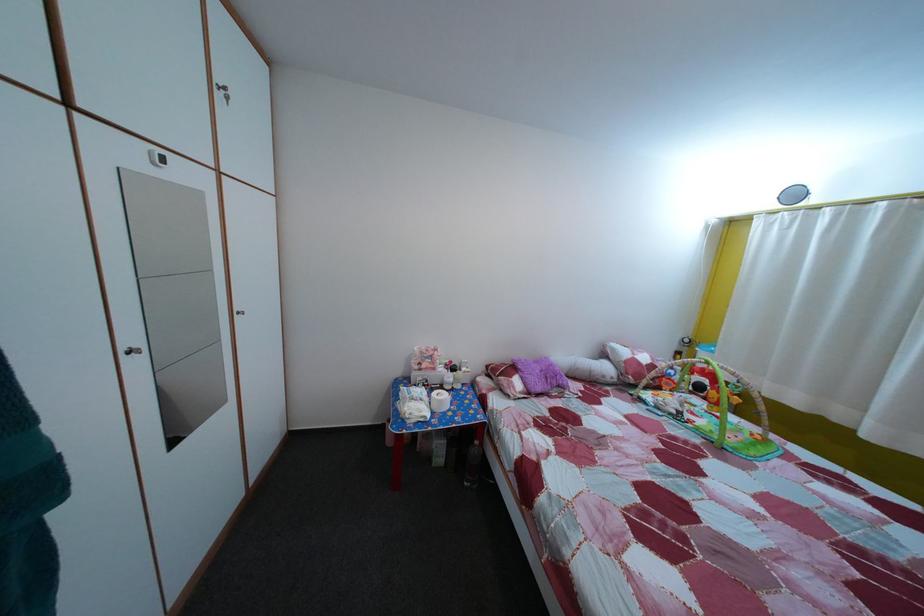
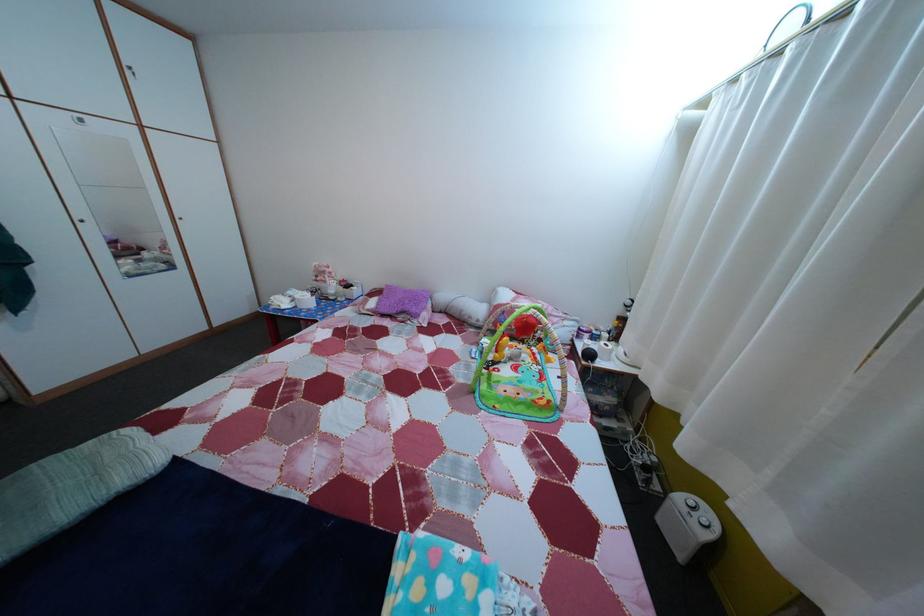
Question: What movement of the cameraman would produce the second image?

Choices:
 (A) Left
 (B) Right
 (C) Forward
 (D) Backward

Answer: (B)